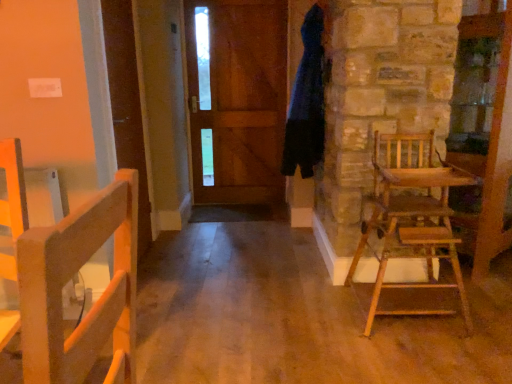
Question: Can you confirm if wooden high chair at right is positioned to the right of wooden door at center?

Choices:
 (A) yes
 (B) no

Answer: (A)

Question: Does wooden high chair at right have a greater width compared to wooden door at center?

Choices:
 (A) no
 (B) yes

Answer: (B)

Question: From the image's perspective, is wooden high chair at right on wooden door at center?

Choices:
 (A) yes
 (B) no

Answer: (B)

Question: Is wooden high chair at right looking in the opposite direction of wooden door at center?

Choices:
 (A) yes
 (B) no

Answer: (B)

Question: Is wooden high chair at right completely or partially outside of wooden door at center?

Choices:
 (A) yes
 (B) no

Answer: (A)

Question: In terms of height, does dark blue fabric bathrobe at upper right look taller or shorter compared to wooden door at center?

Choices:
 (A) tall
 (B) short

Answer: (B)

Question: Is dark blue fabric bathrobe at upper right bigger or smaller than wooden door at center?

Choices:
 (A) small
 (B) big

Answer: (B)

Question: Considering the positions of point (309, 144) and point (249, 26), is point (309, 144) closer or farther from the camera than point (249, 26)?

Choices:
 (A) closer
 (B) farther

Answer: (A)

Question: From a real-world perspective, is dark blue fabric bathrobe at upper right above or below wooden door at center?

Choices:
 (A) below
 (B) above

Answer: (B)

Question: From the image's perspective, is wooden door at center positioned above or below wooden high chair at right?

Choices:
 (A) above
 (B) below

Answer: (A)

Question: Is wooden door at center in front of or behind wooden high chair at right in the image?

Choices:
 (A) front
 (B) behind

Answer: (B)

Question: Is wooden door at center inside the boundaries of wooden high chair at right, or outside?

Choices:
 (A) outside
 (B) inside

Answer: (A)

Question: In terms of height, does wooden door at center look taller or shorter compared to wooden high chair at right?

Choices:
 (A) tall
 (B) short

Answer: (A)

Question: In terms of width, does wooden high chair at right look wider or thinner when compared to wooden door at center?

Choices:
 (A) wide
 (B) thin

Answer: (A)

Question: Is point (422, 218) closer or farther from the camera than point (245, 92)?

Choices:
 (A) farther
 (B) closer

Answer: (B)